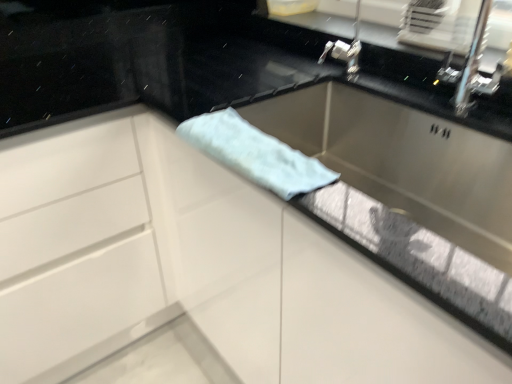
Question: From a real-world perspective, is white glossy cabinet at left over light blue fabric at center?

Choices:
 (A) yes
 (B) no

Answer: (B)

Question: Could you tell me if white glossy cabinet at left is facing light blue fabric at center?

Choices:
 (A) no
 (B) yes

Answer: (B)

Question: Is white glossy cabinet at left bigger than light blue fabric at center?

Choices:
 (A) yes
 (B) no

Answer: (A)

Question: Is light blue fabric at center completely or partially inside white glossy cabinet at left?

Choices:
 (A) no
 (B) yes

Answer: (A)

Question: Is white glossy cabinet at left directly adjacent to light blue fabric at center?

Choices:
 (A) yes
 (B) no

Answer: (B)

Question: Can you confirm if white glossy cabinet at left is wider than light blue fabric at center?

Choices:
 (A) yes
 (B) no

Answer: (A)

Question: From the image's perspective, is light blue fabric at center beneath white glossy cabinet at left?

Choices:
 (A) no
 (B) yes

Answer: (A)

Question: Does light blue fabric at center have a lesser height compared to white glossy cabinet at left?

Choices:
 (A) yes
 (B) no

Answer: (A)

Question: Is light blue fabric at center wider than white glossy cabinet at left?

Choices:
 (A) yes
 (B) no

Answer: (B)

Question: From a real-world perspective, is light blue fabric at center beneath white glossy cabinet at left?

Choices:
 (A) yes
 (B) no

Answer: (B)

Question: Is light blue fabric at center at the left side of white glossy cabinet at left?

Choices:
 (A) yes
 (B) no

Answer: (B)

Question: Can you confirm if light blue fabric at center is positioned to the right of white glossy cabinet at left?

Choices:
 (A) yes
 (B) no

Answer: (A)

Question: From a real-world perspective, is white glossy cabinet at left above or below light blue fabric at center?

Choices:
 (A) below
 (B) above

Answer: (A)